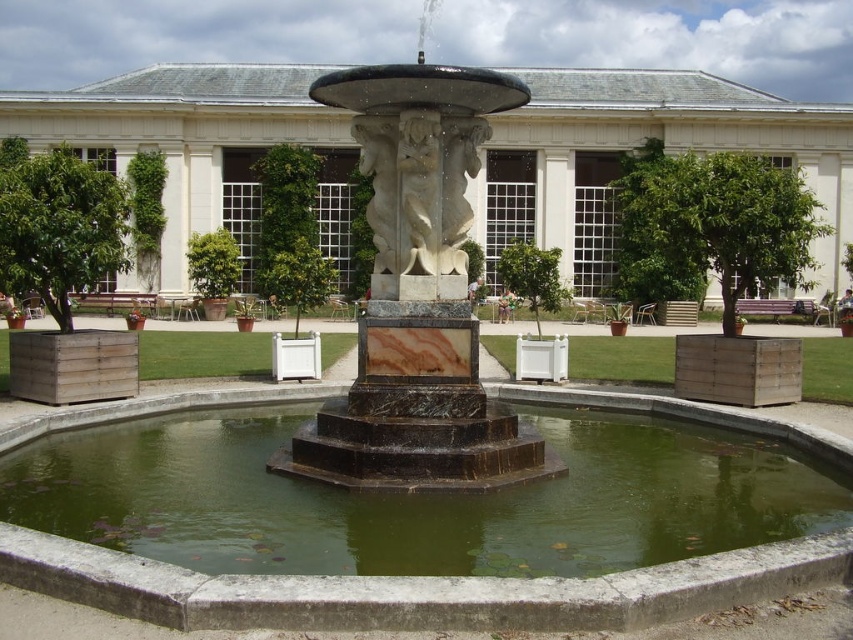
Who is shorter, green marble water at center or marble statue at center?

Standing shorter between the two is green marble water at center.

Can you confirm if green marble water at center is positioned below marble statue at center?

Correct, green marble water at center is located below marble statue at center.

Where is `green marble water at center`? green marble water at center is located at coordinates (416, 589).

The width and height of the screenshot is (853, 640). I want to click on green marble water at center, so click(x=416, y=589).

Is white marble fountain at center taller than white marble statue at center?

Correct, white marble fountain at center is much taller as white marble statue at center.

Is point (529, 131) positioned after point (468, 131)?

Yes, point (529, 131) is behind point (468, 131).

The width and height of the screenshot is (853, 640). Identify the location of white marble fountain at center. (637, 145).

Where is `white marble fountain at center`? The height and width of the screenshot is (640, 853). white marble fountain at center is located at coordinates (637, 145).

Which is in front, point (384, 129) or point (444, 186)?

Point (384, 129)

Is point (469, 163) less distant than point (392, 138)?

No, (469, 163) is further to viewer.

Describe the element at coordinates (416, 294) in the screenshot. This screenshot has height=640, width=853. I see `marble statue at center` at that location.

You are a GUI agent. You are given a task and a screenshot of the screen. Output one action in this format:
    pyautogui.click(x=<x>, y=<y>)
    Task: Click on the marble statue at center
    
    Given the screenshot: What is the action you would take?
    pyautogui.click(x=416, y=294)